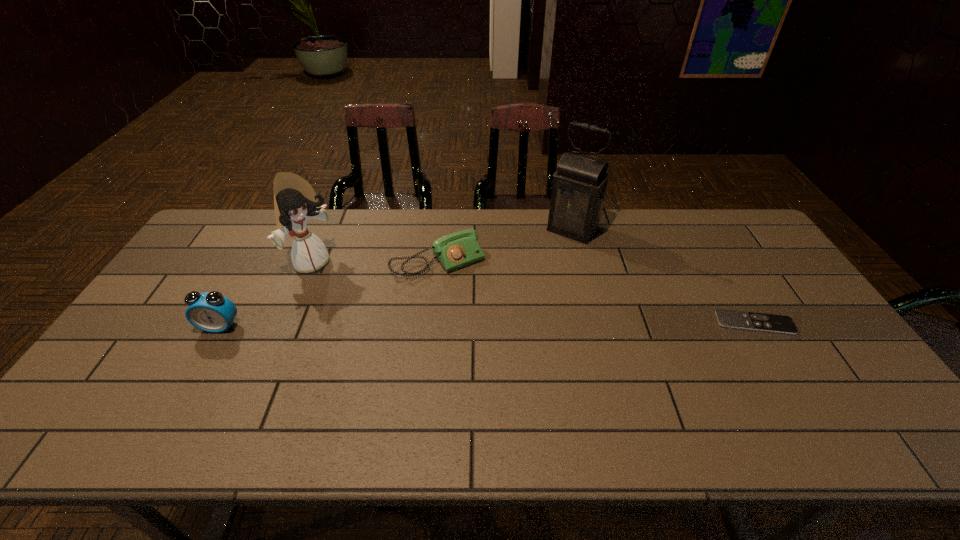
Locate an element on the screen. free spot between the alarm clock and the fourth tallest object is located at coordinates pyautogui.click(x=329, y=294).

I want to click on vacant area that lies between the rightmost object and the lantern, so click(663, 276).

Image resolution: width=960 pixels, height=540 pixels. What are the coordinates of `free space between the shortest object and the second tallest object` in the screenshot? It's located at (534, 293).

This screenshot has height=540, width=960. Identify the location of free point between the second shortest object and the remote control. (596, 292).

The width and height of the screenshot is (960, 540). Identify the location of free space between the alarm clock and the doll. (267, 295).

Where is `free space that is in between the lantern and the shortest object`? The height and width of the screenshot is (540, 960). free space that is in between the lantern and the shortest object is located at coordinates (663, 276).

Identify the location of free space between the fourth shortest object and the rightmost object. The image size is (960, 540). (534, 293).

This screenshot has width=960, height=540. I want to click on vacant point located between the remote control and the fourth object from right to left, so (534, 293).

At what (x,y) coordinates should I click in order to perform the action: click on vacant region between the third object from left to right and the tallest object. Please return your answer as a coordinate pair (x, y). This screenshot has width=960, height=540. Looking at the image, I should click on (506, 245).

Identify the location of free space between the fourth tallest object and the shortest object. (596, 292).